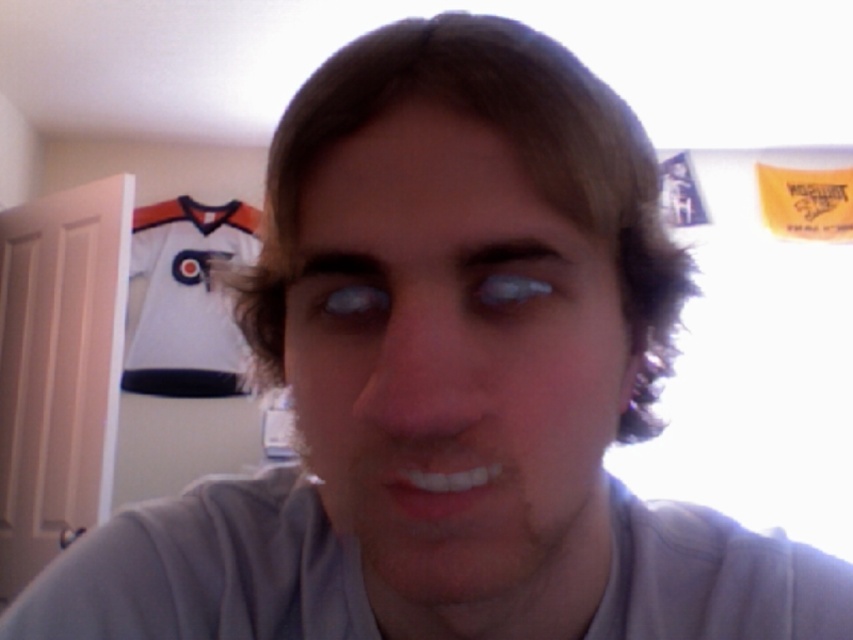
Between white jersey at upper left and translucent plastic eye at center, which one has more height?

white jersey at upper left

Is white jersey at upper left to the right of translucent plastic eye at center from the viewer's perspective?

Incorrect, white jersey at upper left is not on the right side of translucent plastic eye at center.

Between point (141, 332) and point (479, 300), which one is positioned behind?

The point (141, 332) is behind.

Where is `white jersey at upper left`? The width and height of the screenshot is (853, 640). white jersey at upper left is located at coordinates (187, 298).

Is white jersey at upper left wider than blue matte eye at center?

Yes, white jersey at upper left is wider than blue matte eye at center.

Can you confirm if white jersey at upper left is shorter than blue matte eye at center?

No, white jersey at upper left is not shorter than blue matte eye at center.

Where is `white jersey at upper left`? white jersey at upper left is located at coordinates (187, 298).

The width and height of the screenshot is (853, 640). What are the coordinates of `white jersey at upper left` in the screenshot? It's located at (187, 298).

How much distance is there between blue matte eye at center and translucent plastic eye at center?

blue matte eye at center is 1.56 inches away from translucent plastic eye at center.

Is point (364, 301) closer to viewer compared to point (479, 291)?

No, (364, 301) is further to viewer.

Locate an element on the screen. The height and width of the screenshot is (640, 853). blue matte eye at center is located at coordinates (352, 307).